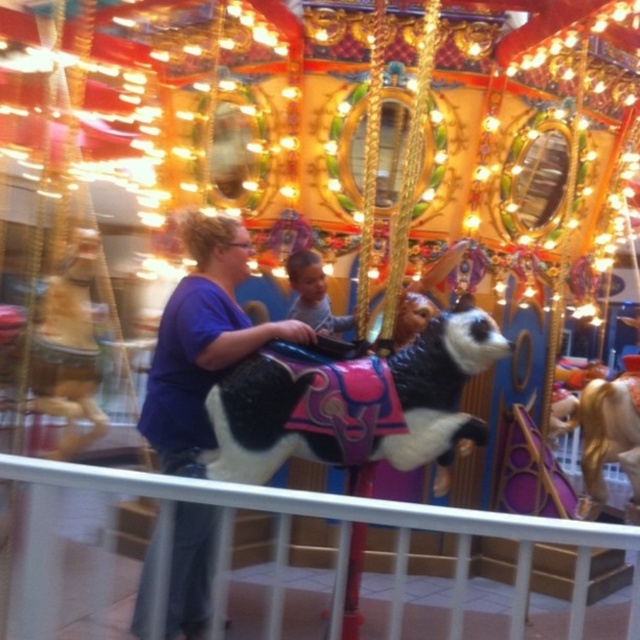
Question: Can you confirm if black and white plush horse at center is smaller than purple cotton shirt at center?

Choices:
 (A) yes
 (B) no

Answer: (A)

Question: Which of these objects is positioned farthest from the smooth skin child at center?

Choices:
 (A) black and white plush horse at center
 (B) golden polished horse at right
 (C) purple cotton shirt at center

Answer: (B)

Question: Does golden polished horse at right come behind smooth skin child at center?

Choices:
 (A) no
 (B) yes

Answer: (B)

Question: Does black and white plush horse at center have a greater width compared to smooth skin child at center?

Choices:
 (A) yes
 (B) no

Answer: (B)

Question: Which object appears farthest from the camera in this image?

Choices:
 (A) golden polished horse at right
 (B) smooth skin child at center

Answer: (A)

Question: Based on their relative distances, which object is nearer to the smooth skin child at center?

Choices:
 (A) black and white plush horse at center
 (B) golden polished horse at right
 (C) purple cotton shirt at center

Answer: (C)